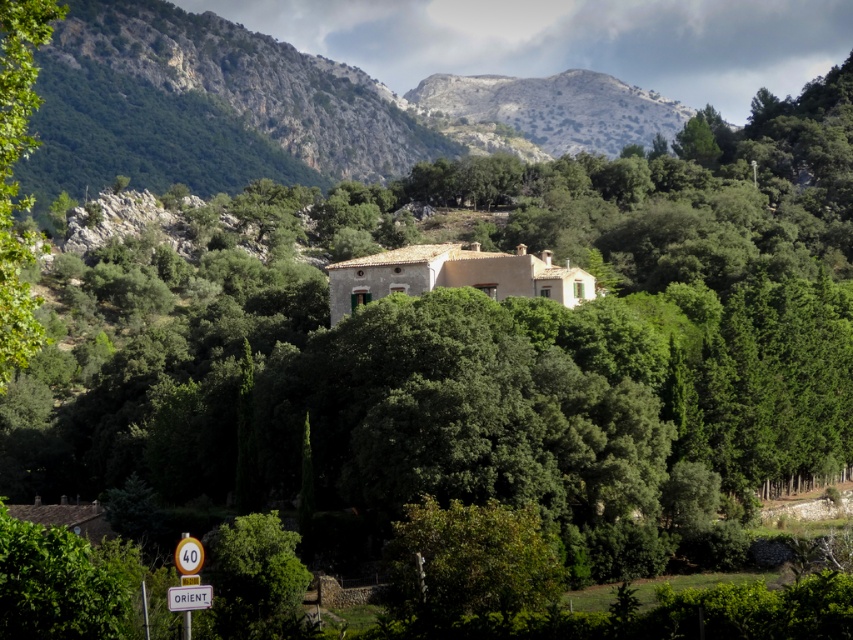
Question: Estimate the real-world distances between objects in this image. Which object is closer to the green leafy tree at left?

Choices:
 (A) green leafy tree at lower center
 (B) green leafy tree at lower left

Answer: (A)

Question: Can you confirm if green leafy tree at lower left is positioned above yellow plastic speed limit sign at lower left?

Choices:
 (A) no
 (B) yes

Answer: (A)

Question: Which point is closer to the camera taking this photo?

Choices:
 (A) (190, 595)
 (B) (549, 112)
 (C) (222, 600)

Answer: (A)

Question: Can you confirm if rugged stone hillside at upper center is positioned to the right of white plastic sign at center?

Choices:
 (A) yes
 (B) no

Answer: (A)

Question: Estimate the real-world distances between objects in this image. Which object is farther from the rugged stone hillside at upper center?

Choices:
 (A) green leafy tree at lower center
 (B) green leafy tree at left

Answer: (A)

Question: Is green leafy tree at left behind green leafy tree at lower left?

Choices:
 (A) no
 (B) yes

Answer: (A)